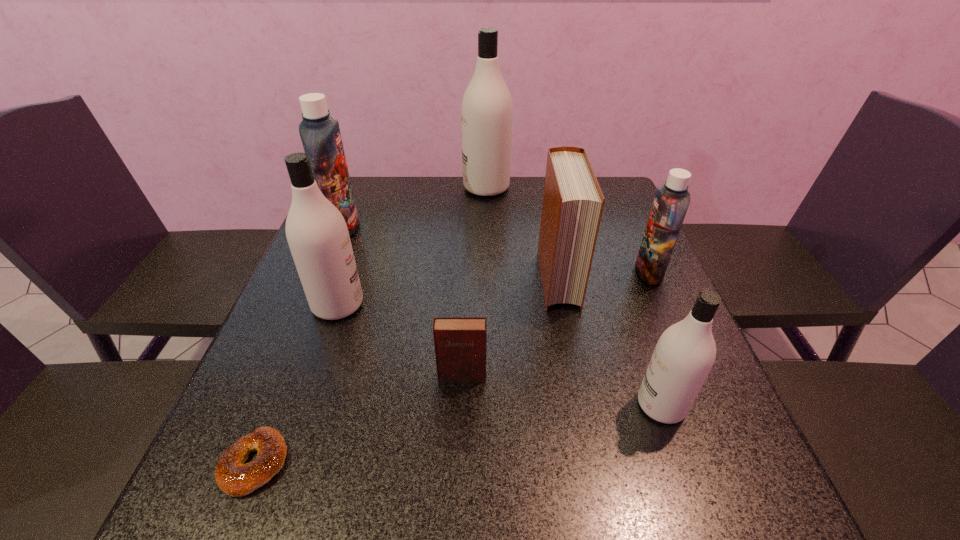
The image size is (960, 540). I want to click on vacant space located on the open cover of the hardback book, so click(x=593, y=458).

In order to click on vacant region located 0.090m on the front label of the rightmost shampoo in this screenshot , I will do `click(599, 272)`.

You are a GUI agent. You are given a task and a screenshot of the screen. Output one action in this format:
    pyautogui.click(x=<x>, y=<y>)
    Task: Click on the vacant area located 0.080m on the front label of the rightmost shampoo
    
    Given the screenshot: What is the action you would take?
    pyautogui.click(x=603, y=272)

The width and height of the screenshot is (960, 540). In order to click on vacant region located 0.360m on the front label of the rightmost shampoo in this screenshot , I will do `click(490, 272)`.

Locate an element on the screen. Image resolution: width=960 pixels, height=540 pixels. free space located on the front-facing side of the nearest shampoo is located at coordinates (467, 405).

Find the location of a particular element. Image resolution: width=960 pixels, height=540 pixels. free spot located 0.200m on the front-facing side of the nearest shampoo is located at coordinates (527, 405).

Locate an element on the screen. The image size is (960, 540). free spot located on the front-facing side of the nearest shampoo is located at coordinates (434, 405).

Where is `free space located 0.080m on the front cover of the reddish-brown diary`? The image size is (960, 540). free space located 0.080m on the front cover of the reddish-brown diary is located at coordinates (460, 420).

Image resolution: width=960 pixels, height=540 pixels. In order to click on vacant region located 0.390m on the right of the brown bagel in this screenshot , I will do `click(524, 463)`.

At what (x,y) coordinates should I click in order to perform the action: click on object positioned at the near edge. Please return your answer as a coordinate pair (x, y). Image resolution: width=960 pixels, height=540 pixels. Looking at the image, I should click on (233, 477).